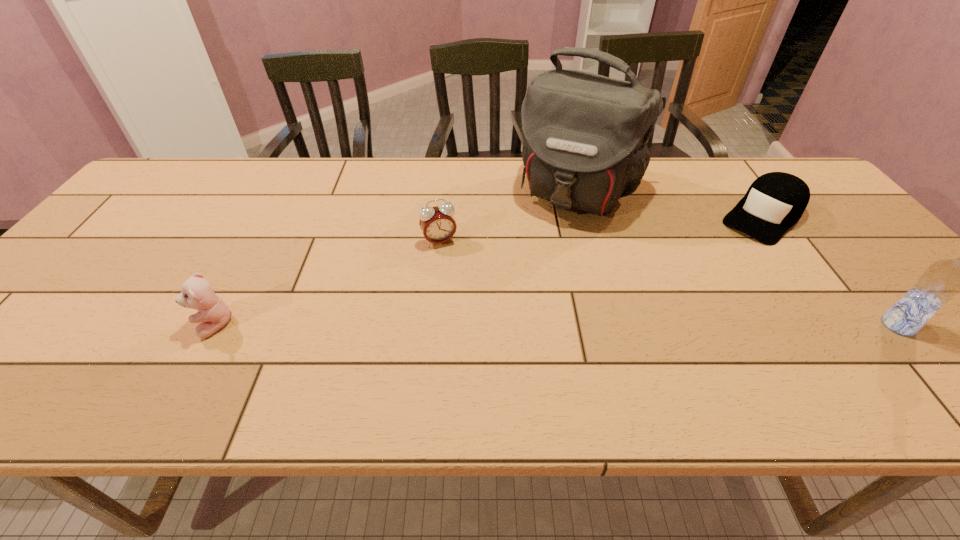
Identify the location of shoulder bag at the far edge. The width and height of the screenshot is (960, 540). (585, 135).

Find the location of `teddy bear that is at the near edge`. teddy bear that is at the near edge is located at coordinates (197, 293).

In order to click on vodka that is at the near edge in this screenshot , I will do `click(942, 280)`.

Identify the location of vodka at the right edge. (942, 280).

Identify the location of cap located in the right edge section of the desktop. (775, 201).

This screenshot has height=540, width=960. I want to click on object that is at the far right corner, so click(775, 201).

You are a GUI agent. You are given a task and a screenshot of the screen. Output one action in this format:
    pyautogui.click(x=<x>, y=<y>)
    Task: Click on the object that is at the near right corner
    The image size is (960, 540).
    Given the screenshot: What is the action you would take?
    pyautogui.click(x=942, y=280)

Locate an element on the screen. The height and width of the screenshot is (540, 960). vacant position at the far edge of the desktop is located at coordinates (396, 162).

You are a GUI agent. You are given a task and a screenshot of the screen. Output one action in this format:
    pyautogui.click(x=<x>, y=<y>)
    Task: Click on the blank space at the near edge
    
    Given the screenshot: What is the action you would take?
    pyautogui.click(x=336, y=330)

The width and height of the screenshot is (960, 540). Identify the location of free spot at the left edge of the desktop. (137, 252).